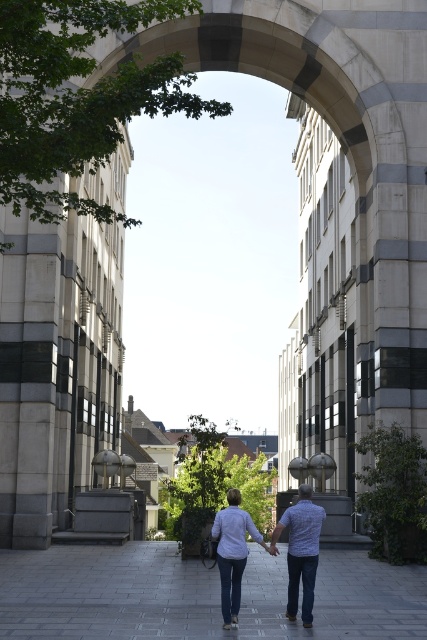
What is the location of the point labeled as point (198,595) in the image?

The point labeled as point (198,595) is located on the gray concrete pavement at center.

You are standing at the base of the archway and want to take a photo of the plaid shirt at center and the gray concrete pavement at center. Which object should you focus on first if you want both to be in sharp focus?

The gray concrete pavement at center is located below the plaid shirt at center. To have both in focus, focus on the plaid shirt at center since it is closer to the camera, ensuring the pavement in the background is also sharp.